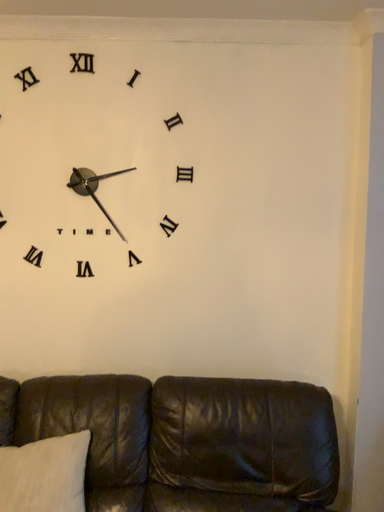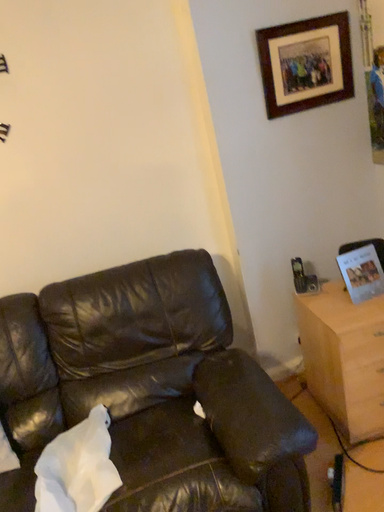
Question: How did the camera likely rotate when shooting the video?

Choices:
 (A) rotated downward
 (B) rotated upward

Answer: (A)